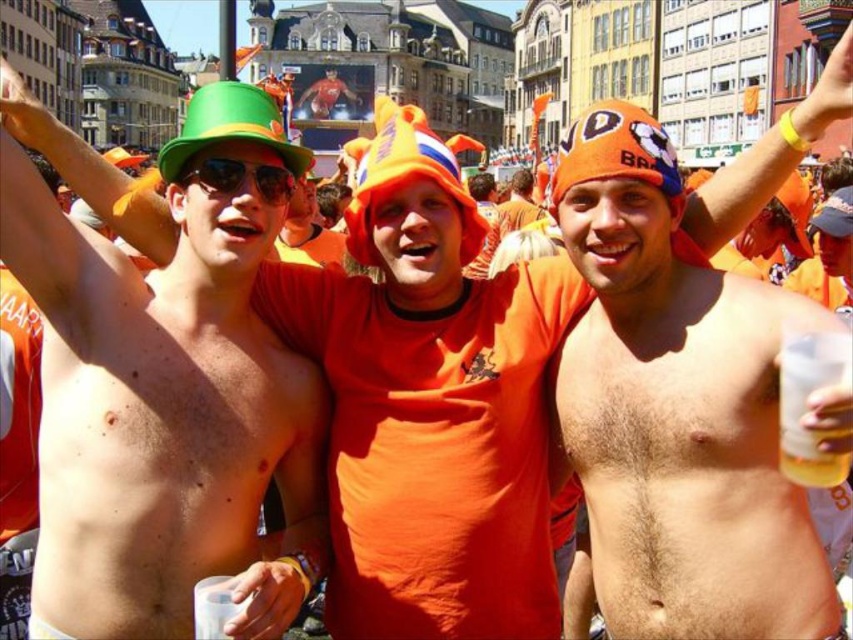
In the scene shown: You are at the event and want to grab the shiny plastic cup at upper left. Based on its coordinates, where should you look to find it?

The shiny plastic cup at upper left is located at coordinates point (167, 397).